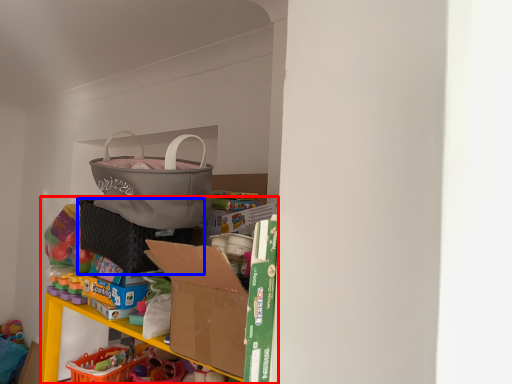
Question: Which of the following is the closest to the observer, bookshelf (highlighted by a red box) or laundry basket (highlighted by a blue box)?

Choices:
 (A) bookshelf
 (B) laundry basket

Answer: (A)